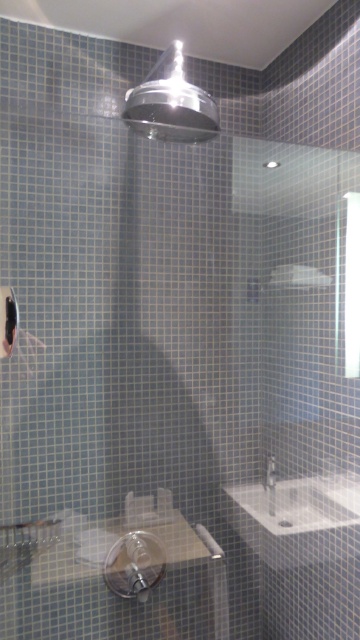
You are a plumber inspecting the bathroom and need to access the pipes behind the white glossy sink at lower right and the white glossy faucet at lower right. Which object would you need to move first to reach the pipes behind both?

The white glossy sink at lower right is in front of the white glossy faucet at lower right, so you need to move the white glossy sink at lower right first to access the pipes behind both.

You are designing a bathroom layout and need to place a 1.2 meter wide vanity next to the white glossy sink at lower right. The polished chrome shower head at upper center is above the shower area. Can the vanity fit next to the sink without blocking the shower head?

The white glossy sink at lower right is wider than the polished chrome shower head at upper center. Since the vanity is 1.2 meters wide, it depends on the sink and shower head placement. However, the shower head is at upper center, so as long as the vanity is placed below and to the side, it shouldn